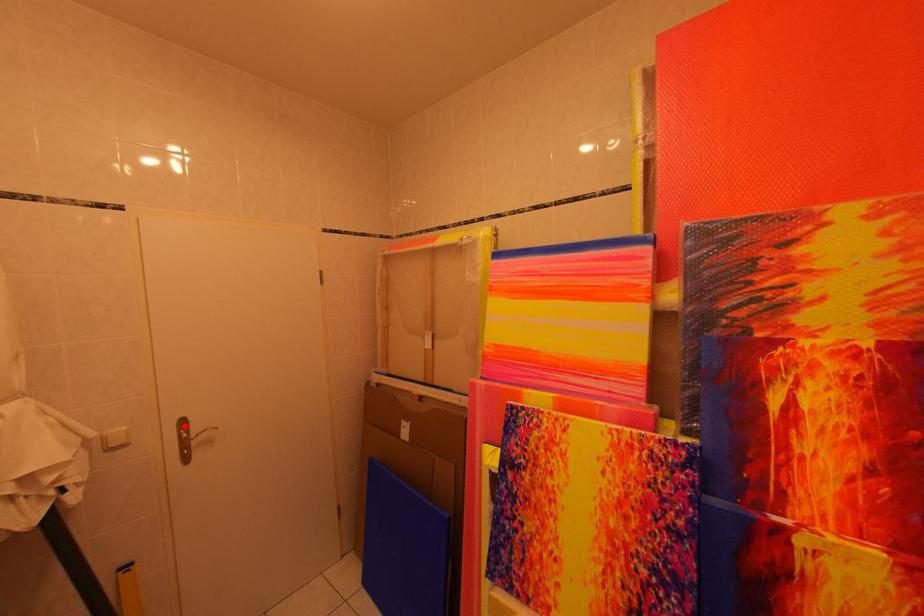
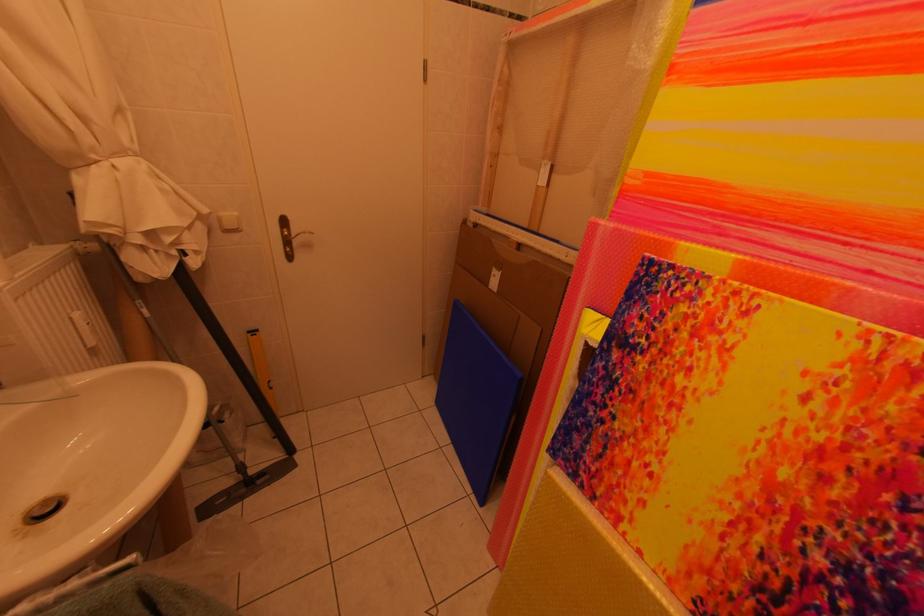
The point at the highlighted location is marked in the first image. Where is the corresponding point in the second image?

(286, 223)